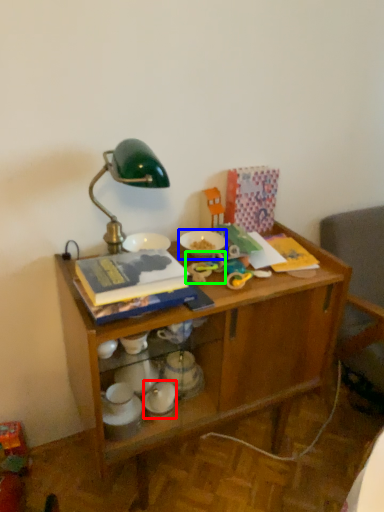
Question: Which object is positioned farthest from tableware (highlighted by a red box)? Select from tableware (highlighted by a blue box) and toy (highlighted by a green box).

Choices:
 (A) tableware
 (B) toy

Answer: (A)